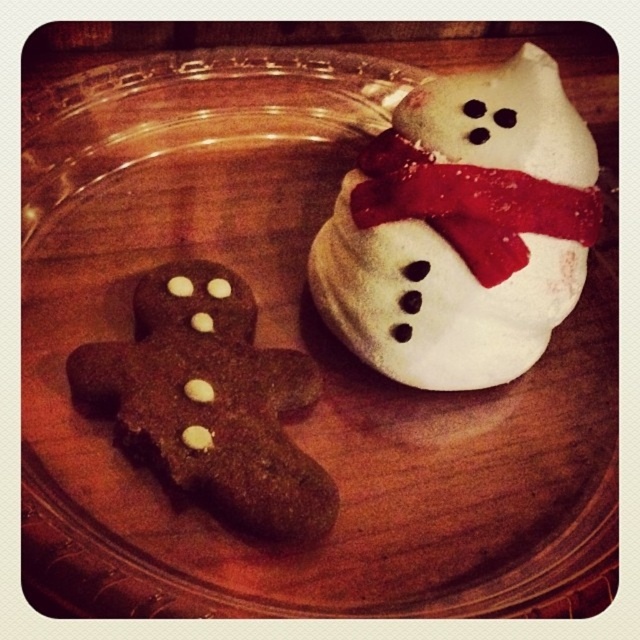
Can you confirm if white frosted cookie at upper right is positioned to the left of brown matte gingerbread man at left?

In fact, white frosted cookie at upper right is to the right of brown matte gingerbread man at left.

How far apart are white frosted cookie at upper right and brown matte gingerbread man at left?

white frosted cookie at upper right is 10.14 inches away from brown matte gingerbread man at left.

Measure the distance between point (556, 280) and camera.

1.22 meters

At what (x,y) coordinates should I click in order to perform the action: click on white frosted cookie at upper right. Please return your answer as a coordinate pair (x, y). This screenshot has width=640, height=640. Looking at the image, I should click on (461, 228).

Is point (488, 163) in front of point (492, 196)?

No, it is not.

Image resolution: width=640 pixels, height=640 pixels. What do you see at coordinates (461, 228) in the screenshot?
I see `white frosted cookie at upper right` at bounding box center [461, 228].

You are a GUI agent. You are given a task and a screenshot of the screen. Output one action in this format:
    pyautogui.click(x=<x>, y=<y>)
    Task: Click on the white frosted cookie at upper right
    
    Given the screenshot: What is the action you would take?
    pyautogui.click(x=461, y=228)

How far apart are brown matte gingerbread man at left and red fabric scarf at upper right?

The distance of brown matte gingerbread man at left from red fabric scarf at upper right is 33.09 centimeters.

Is point (268, 358) closer to viewer compared to point (412, 161)?

No.

The width and height of the screenshot is (640, 640). What do you see at coordinates (209, 401) in the screenshot?
I see `brown matte gingerbread man at left` at bounding box center [209, 401].

Where is `brown matte gingerbread man at left`? This screenshot has height=640, width=640. brown matte gingerbread man at left is located at coordinates (209, 401).